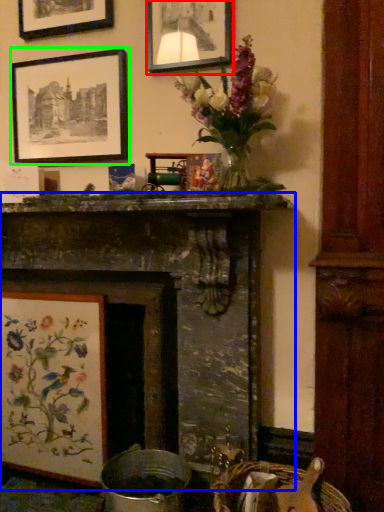
Question: Which object is the closest to the picture frame (highlighted by a red box)? Choose among these: fireplace (highlighted by a blue box) or picture frame (highlighted by a green box).

Choices:
 (A) fireplace
 (B) picture frame

Answer: (B)